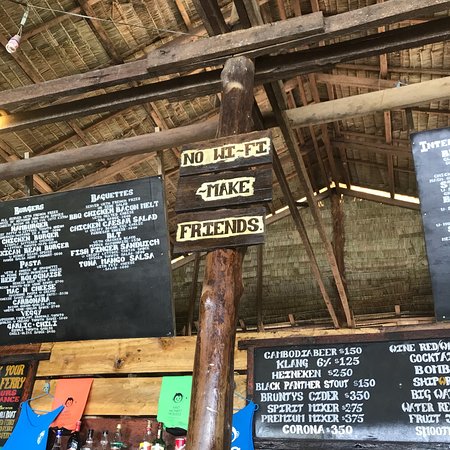
The image size is (450, 450). I want to click on wooden support pole, so click(x=218, y=317).